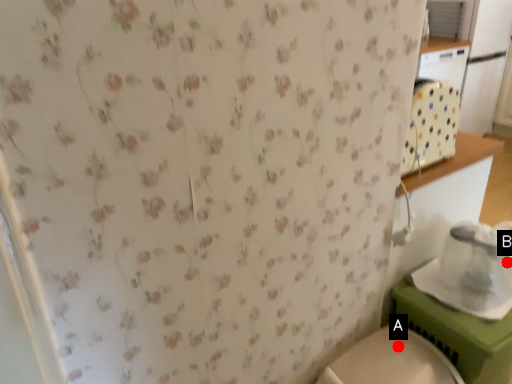
Question: Two points are circled on the image, labeled by A and B beside each circle. Which of the following is the closest to the observer?

Choices:
 (A) A is closer
 (B) B is closer

Answer: (B)